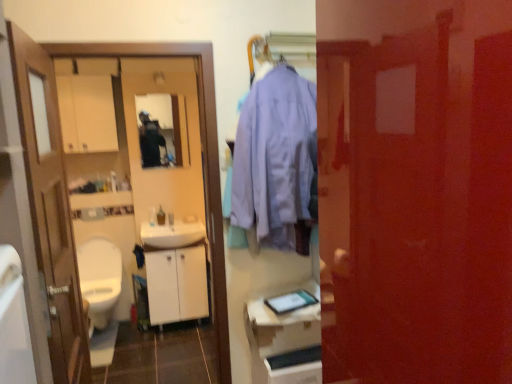
Question: Does matte black tablet at center appear on the right side of white matte cabinet at center, positioned as the first cabinetry in back-to-front order?

Choices:
 (A) yes
 (B) no

Answer: (A)

Question: Does matte black tablet at center appear on the left side of white matte cabinet at center, marked as the first cabinetry in a left-to-right arrangement?

Choices:
 (A) yes
 (B) no

Answer: (B)

Question: Does matte black tablet at center touch white matte cabinet at center, marked as the first cabinetry in a left-to-right arrangement?

Choices:
 (A) yes
 (B) no

Answer: (B)

Question: From a real-world perspective, is matte black tablet at center on white matte cabinet at center, the 2th cabinetry viewed from the right?

Choices:
 (A) yes
 (B) no

Answer: (A)

Question: From a real-world perspective, is matte black tablet at center under white matte cabinet at center, positioned as the first cabinetry in back-to-front order?

Choices:
 (A) no
 (B) yes

Answer: (A)

Question: Considering the positions of matte red door at center, arranged as the 2th door when viewed from the left, and matte black mirror at upper center in the image, is matte red door at center, arranged as the 2th door when viewed from the left, wider or thinner than matte black mirror at upper center?

Choices:
 (A) thin
 (B) wide

Answer: (B)

Question: Is matte red door at center, arranged as the 2th door when viewed from the left, inside the boundaries of matte black mirror at upper center, or outside?

Choices:
 (A) inside
 (B) outside

Answer: (B)

Question: From the image's perspective, is matte red door at center, arranged as the 2th door when viewed from the left, located above or below matte black mirror at upper center?

Choices:
 (A) above
 (B) below

Answer: (B)

Question: Considering the positions of point (484, 297) and point (168, 145), is point (484, 297) closer or farther from the camera than point (168, 145)?

Choices:
 (A) closer
 (B) farther

Answer: (A)

Question: Is matte black mirror at upper center taller or shorter than translucent plastic bottle at center?

Choices:
 (A) tall
 (B) short

Answer: (A)

Question: From a real-world perspective, relative to translucent plastic bottle at center, is matte black mirror at upper center vertically above or below?

Choices:
 (A) below
 (B) above

Answer: (B)

Question: Is matte black mirror at upper center inside or outside of translucent plastic bottle at center?

Choices:
 (A) inside
 (B) outside

Answer: (B)

Question: Is matte black mirror at upper center wider or thinner than translucent plastic bottle at center?

Choices:
 (A) thin
 (B) wide

Answer: (A)

Question: Relative to matte black tablet at center, is white glossy sink at center in front or behind?

Choices:
 (A) behind
 (B) front

Answer: (A)

Question: Considering the positions of point (194, 241) and point (317, 289), is point (194, 241) closer or farther from the camera than point (317, 289)?

Choices:
 (A) closer
 (B) farther

Answer: (B)